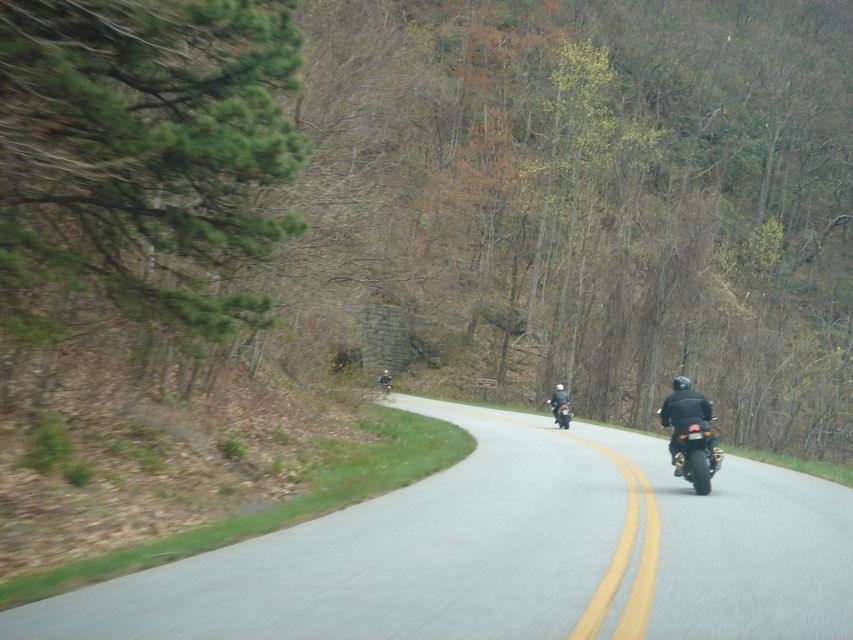
You are standing at the origin point in the image. Which direction should you walk to reach the gray asphalt road at center?

The gray asphalt road at center is located at coordinates approximately 0.866 on the x axis and 0.599 on the y axis. Since you are at the origin, you should move in the positive x and positive y directions to reach it.

You are a pedestrian standing on the gray asphalt road at center and want to cross to the shiny black motorcycle at right. Is there enough space between them for a 1.8 meter wide delivery cart to pass through?

The distance between the gray asphalt road at center and the shiny black motorcycle at right is 3.05 meters. Since the delivery cart is 1.8 meters wide, there is sufficient space for it to pass through.

You are a photographer positioned at the camera location. You want to take a photo of both the point at (x=550, y=531) and the point at (x=701, y=420). Which point will appear larger in the photo?

Point at (x=550, y=531) will appear larger in the photo because it is closer to the camera than point at (x=701, y=420).